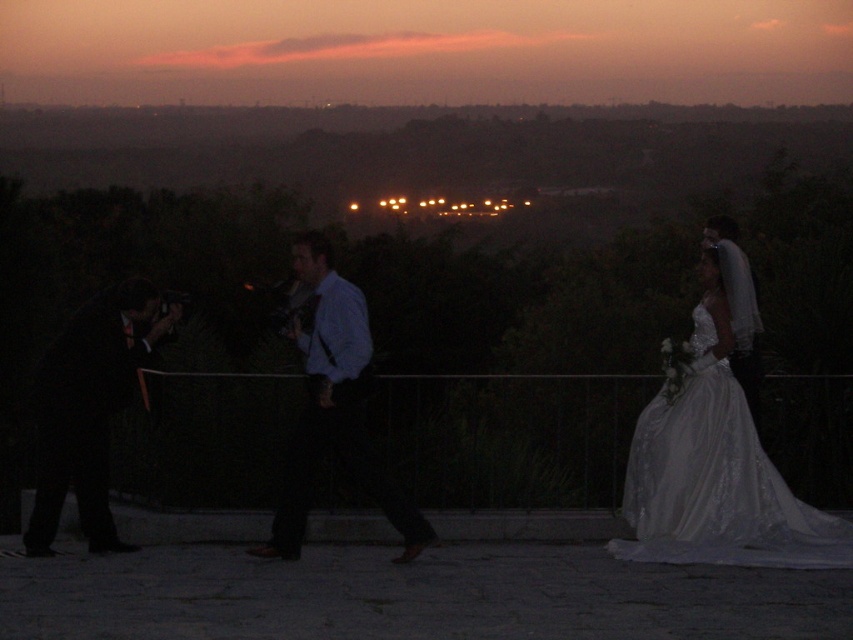
Is white satin dress at right taller than black suit at left?

No.

Which of these two, white satin dress at right or black suit at left, stands shorter?

white satin dress at right

Measure the distance between white satin dress at right and camera.

They are 8.24 meters apart.

Identify the location of white satin dress at right. The width and height of the screenshot is (853, 640). (x=717, y=477).

Consider the image. Who is more distant from viewer, (129, 337) or (351, 355)?

The point (129, 337) is more distant.

Does black suit at left have a greater width compared to blue shirt at center?

No, black suit at left is not wider than blue shirt at center.

Who is more forward, (x=39, y=394) or (x=366, y=477)?

Point (x=366, y=477) is in front.

I want to click on black suit at left, so click(90, 406).

Which is above, white satin dress at right or white satin suit at right?

white satin suit at right is higher up.

The height and width of the screenshot is (640, 853). Find the location of `white satin dress at right`. white satin dress at right is located at coordinates (717, 477).

The image size is (853, 640). Identify the location of white satin dress at right. (717, 477).